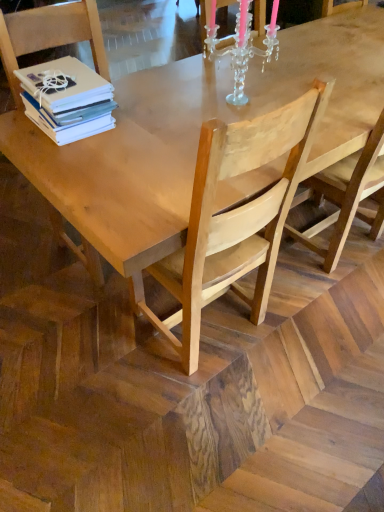
Locate an element on the screen. This screenshot has height=512, width=384. vacant region to the left of clear crystal candle holder at upper center is located at coordinates (180, 102).